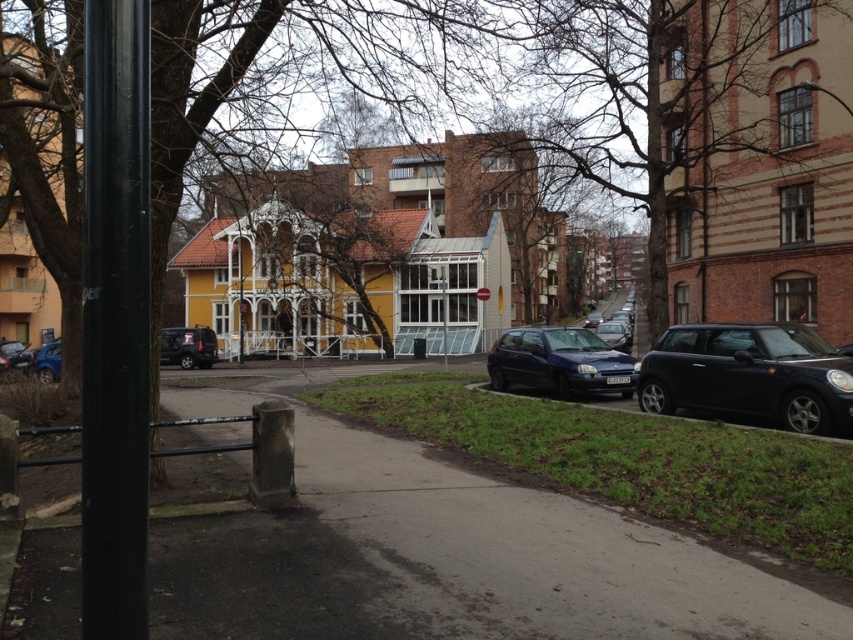
You are a pedestrian standing on the paved pathway in the foreground. You want to walk straight ahead towards the yellow building with white facade. Which object, the brown textured tree at center or the satin blue hatchback at center, will you encounter first?

The brown textured tree at center is closer to the viewer than the satin blue hatchback at center, so you will encounter the brown textured tree at center first.

You are a delivery driver who needs to park your vehicle, which is 4 meters long, in the parking area near the brown textured tree at center and the satin blue hatchback at center. Can your vehicle fit in the available space between them?

The brown textured tree at center is bigger than the satin blue hatchback at center, but the description does not provide specific measurements about the distance between them. Therefore, it is unclear if the 4 meter vehicle can fit in the available space between them.

You are standing at the camera position looking at the urban street scene. There are two points marked in the image, one at coordinates point (827, 378) and another at point (204, 330). Which of these two points is nearer to your current position?

Point (827, 378) is closer to the camera than point (204, 330), so the point at coordinates point (827, 378) is nearer to your current position.